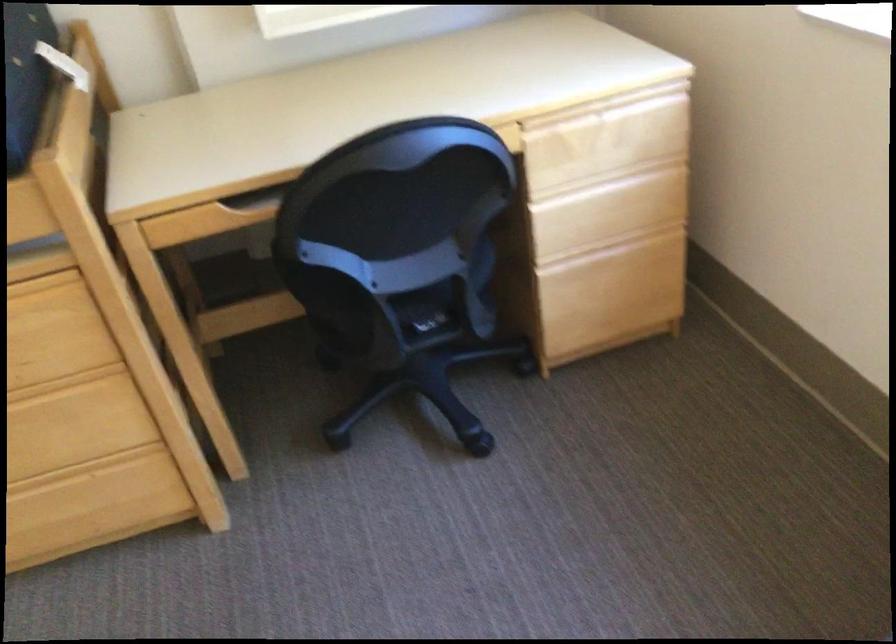
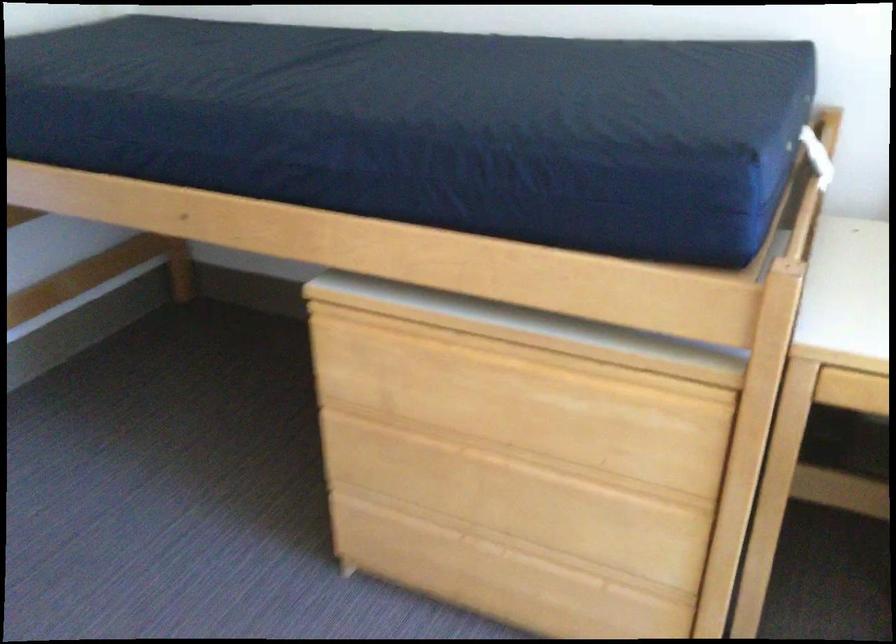
Question: The images are taken continuously from a first-person perspective. In which direction is your viewpoint rotating?

Choices:
 (A) Left
 (B) Right
 (C) Up
 (D) Down

Answer: (A)